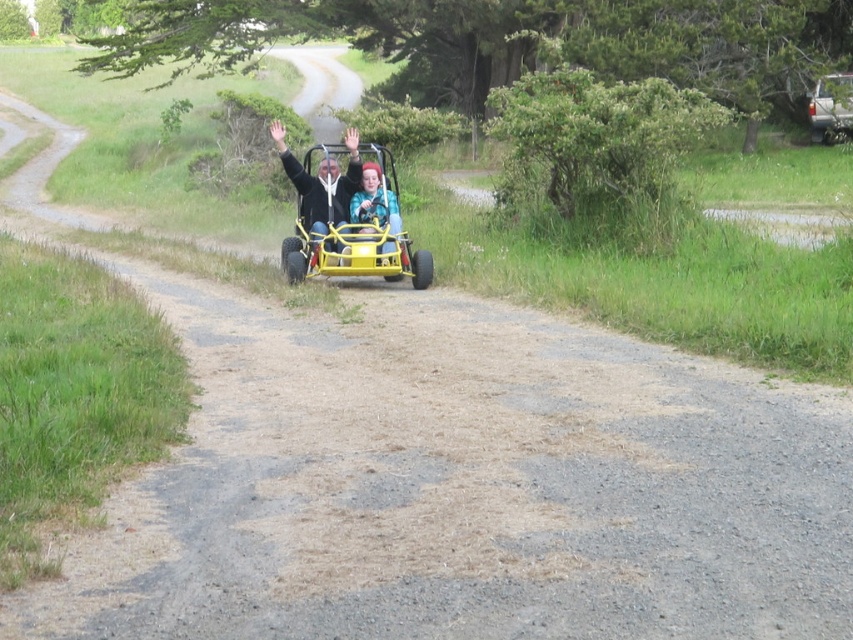
Can you confirm if matte black jacket at center is wider than silver metallic truck at upper right?

In fact, matte black jacket at center might be narrower than silver metallic truck at upper right.

Between matte black jacket at center and silver metallic truck at upper right, which one has less height?

matte black jacket at center is shorter.

Describe the element at coordinates (321, 182) in the screenshot. I see `matte black jacket at center` at that location.

Identify the location of matte black jacket at center. (321, 182).

What do you see at coordinates (349, 218) in the screenshot? I see `yellow matte go-kart at center` at bounding box center [349, 218].

Between yellow matte go-kart at center and matte black jacket at center, which one has less height?

matte black jacket at center

Who is more forward, [276,125] or [312,184]?

Point [312,184] is more forward.

The width and height of the screenshot is (853, 640). I want to click on yellow matte go-kart at center, so click(x=349, y=218).

Between yellow matte go-kart at center and silver metallic truck at upper right, which one is positioned higher?

Positioned higher is silver metallic truck at upper right.

Can you confirm if yellow matte go-kart at center is bigger than silver metallic truck at upper right?

Indeed, yellow matte go-kart at center has a larger size compared to silver metallic truck at upper right.

Between point (399, 243) and point (822, 118), which one is positioned in front?

Point (399, 243)

This screenshot has width=853, height=640. Identify the location of yellow matte go-kart at center. (349, 218).